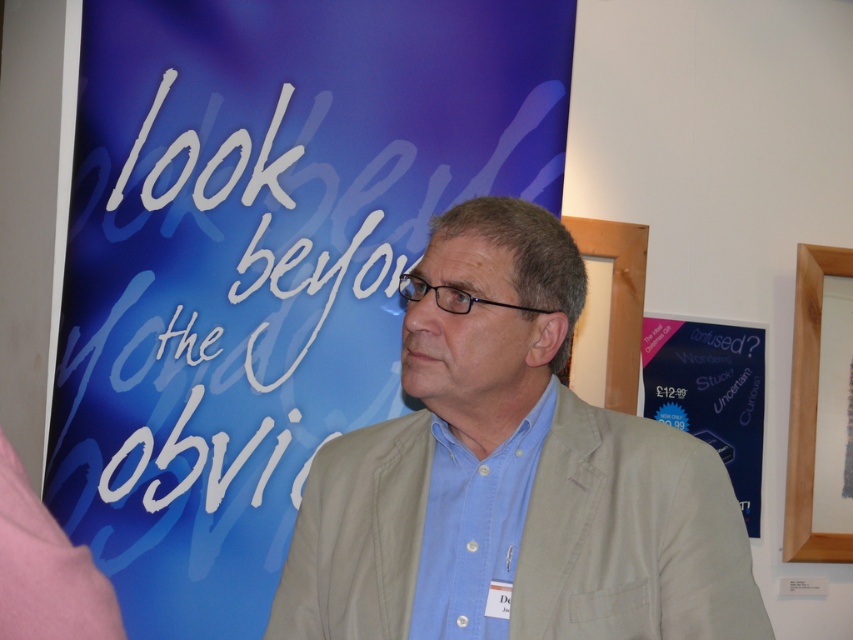
Between blue cotton shirt at center and wooden frame at right, which one appears on the left side from the viewer's perspective?

From the viewer's perspective, blue cotton shirt at center appears more on the left side.

Is blue cotton shirt at center shorter than wooden frame at right?

Yes, blue cotton shirt at center is shorter than wooden frame at right.

Identify the location of blue cotton shirt at center. (474, 529).

Between blue fabric poster at upper left and blue cotton shirt at center, which one is positioned lower?

blue cotton shirt at center is below.

Where is `blue fabric poster at upper left`? blue fabric poster at upper left is located at coordinates (263, 260).

Locate an element on the screen. The height and width of the screenshot is (640, 853). blue fabric poster at upper left is located at coordinates (263, 260).

At what (x,y) coordinates should I click in order to perform the action: click on blue fabric poster at upper left. Please return your answer as a coordinate pair (x, y). Looking at the image, I should click on (263, 260).

Looking at this image, is wooden frame at right smaller than wooden frame at upper right?

No.

What do you see at coordinates (808, 408) in the screenshot? I see `wooden frame at right` at bounding box center [808, 408].

Is point (811, 532) positioned after point (602, 252)?

Yes, it is.

At what (x,y) coordinates should I click in order to perform the action: click on wooden frame at right. Please return your answer as a coordinate pair (x, y). The height and width of the screenshot is (640, 853). Looking at the image, I should click on (808, 408).